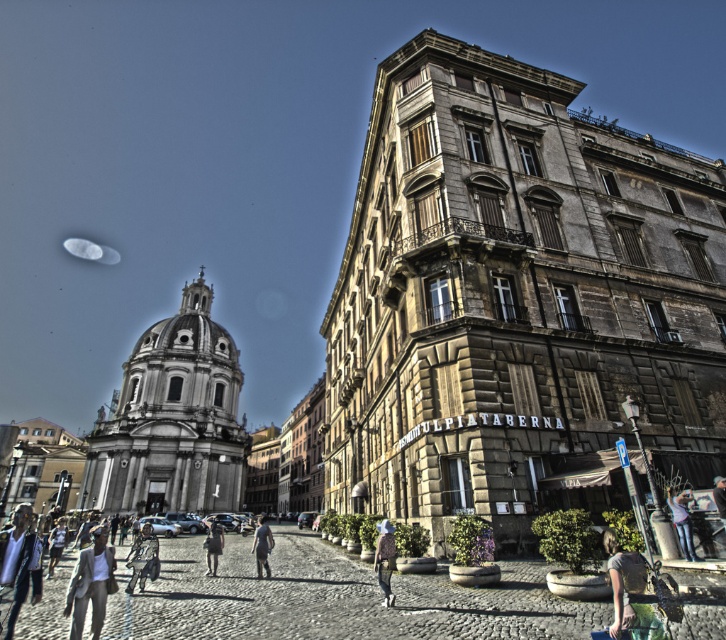
Is point (237, 576) more distant than point (696, 557)?

That is True.

Does smooth stone plaza at center have a larger size compared to denim jacket at lower right?

Correct, smooth stone plaza at center is larger in size than denim jacket at lower right.

Is point (530, 609) positioned after point (689, 556)?

No, (530, 609) is closer to viewer.

The image size is (726, 640). I want to click on smooth stone plaza at center, so click(334, 596).

Who is positioned more to the left, denim jacket at lower right or light brown leather jacket at lower left?

light brown leather jacket at lower left is more to the left.

Which is behind, point (690, 540) or point (54, 564)?

Positioned behind is point (54, 564).

Which is behind, point (672, 499) or point (52, 532)?

Positioned behind is point (52, 532).

This screenshot has height=640, width=726. Identify the location of denim jacket at lower right. (682, 522).

Does point (142, 586) come closer to viewer compared to point (219, 545)?

Yes, it is in front of point (219, 545).

Which is below, metallic silver bicycle at lower left or dark gray fabric jacket at center?

dark gray fabric jacket at center

Is point (131, 566) closer to camera compared to point (208, 536)?

Yes, it is in front of point (208, 536).

Identify the location of metallic silver bicycle at lower left. click(142, 557).